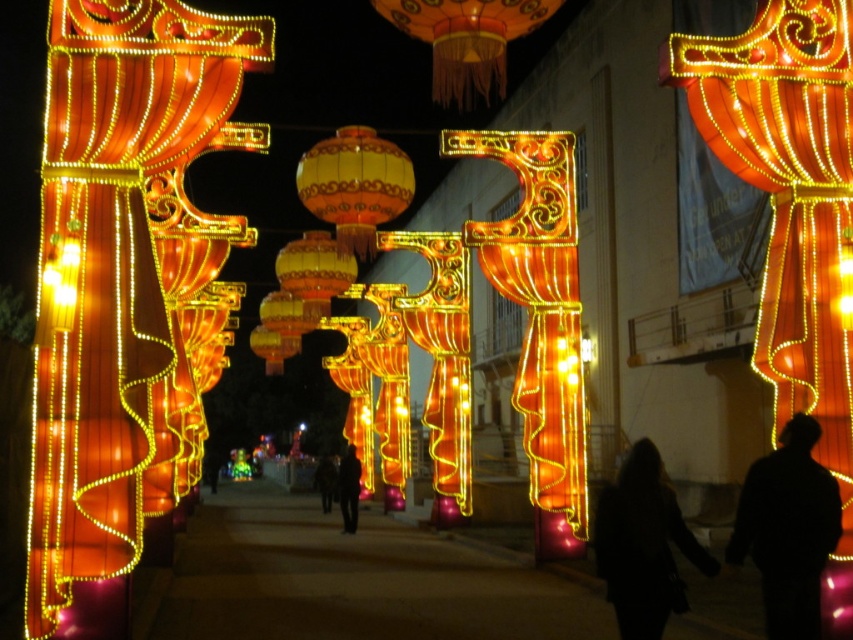
Question: Is matte orange fabric lantern at left to the right of matte orange paper lantern at upper center from the viewer's perspective?

Choices:
 (A) yes
 (B) no

Answer: (B)

Question: Estimate the real-world distances between objects in this image. Which object is closer to the matte orange fabric lantern at left?

Choices:
 (A) silhouette figure at center
 (B) matte yellow lantern at center

Answer: (B)

Question: Can you confirm if matte orange fabric lantern at left is thinner than matte gold lantern at center?

Choices:
 (A) no
 (B) yes

Answer: (A)

Question: Does silhouette figure at center have a larger size compared to dark clothing figure at center?

Choices:
 (A) no
 (B) yes

Answer: (B)

Question: Among these objects, which one is nearest to the camera?

Choices:
 (A) matte orange paper lantern at upper center
 (B) matte orange fabric lantern at left
 (C) matte gold lantern at center

Answer: (B)

Question: Which of the following is the farthest from the observer?

Choices:
 (A) (358, 157)
 (B) (73, 547)
 (C) (405, 28)

Answer: (A)